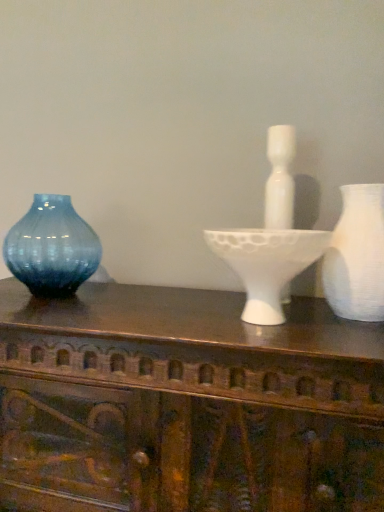
In order to click on vacant space underneath white matte candle holder at center (from a real-world perspective) in this screenshot , I will do `click(263, 326)`.